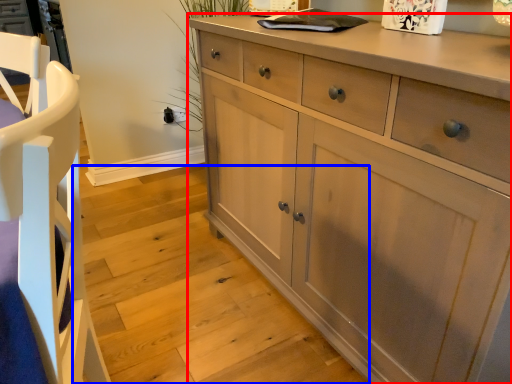
Question: Among these objects, which one is farthest to the camera, chest of drawers (highlighted by a red box) or stair (highlighted by a blue box)?

Choices:
 (A) chest of drawers
 (B) stair

Answer: (B)